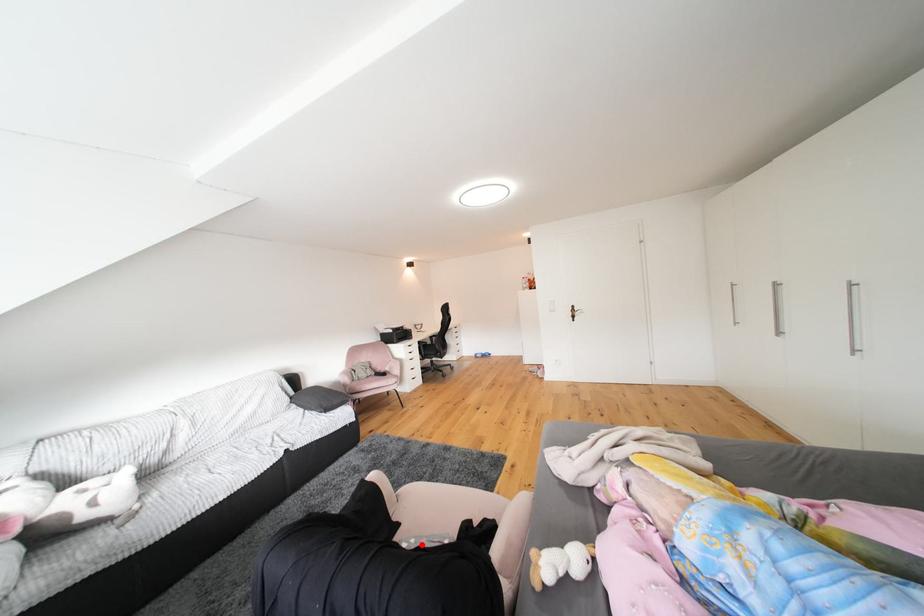
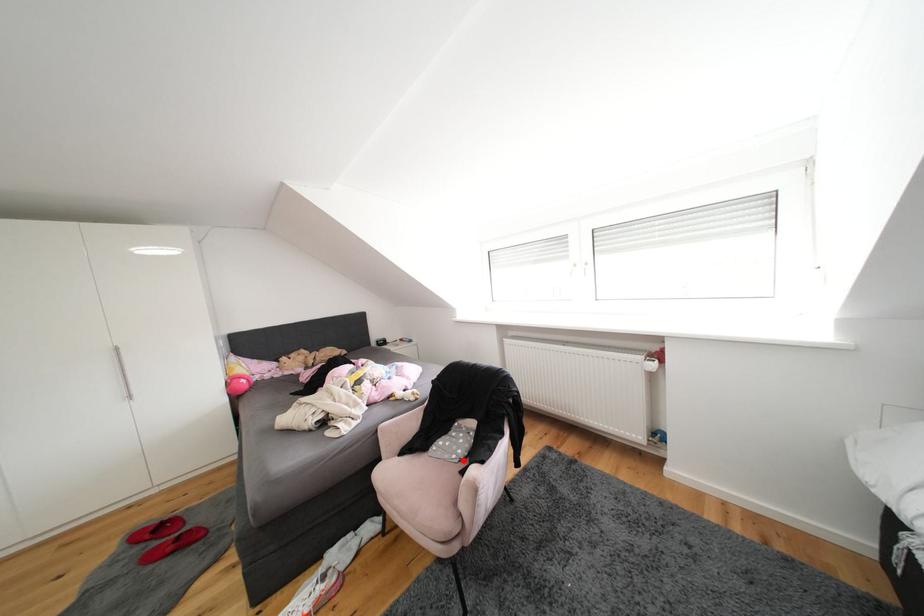
I am providing you with two images of the same scene from different viewpoints. A red point is marked on the first image and another point is marked on the second image. Does the point marked in image1 correspond to the same location as the one in image2?

Yes